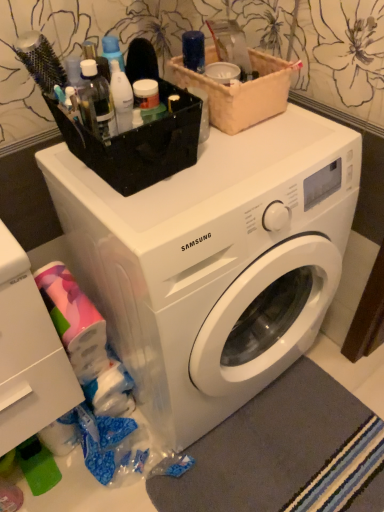
Question: Is white plastic drawer at lower left wider or thinner than beige fabric basket at upper center?

Choices:
 (A) thin
 (B) wide

Answer: (B)

Question: Considering their positions, is white plastic drawer at lower left located in front of or behind beige fabric basket at upper center?

Choices:
 (A) behind
 (B) front

Answer: (B)

Question: Which object is the farthest from the white plastic drawer at lower left?

Choices:
 (A) beige fabric basket at upper center
 (B) white plastic washing machine at center
 (C) gray soft rug at lower right

Answer: (A)

Question: Which object is positioned closest to the beige fabric basket at upper center?

Choices:
 (A) gray soft rug at lower right
 (B) white plastic drawer at lower left
 (C) white plastic washing machine at center

Answer: (C)